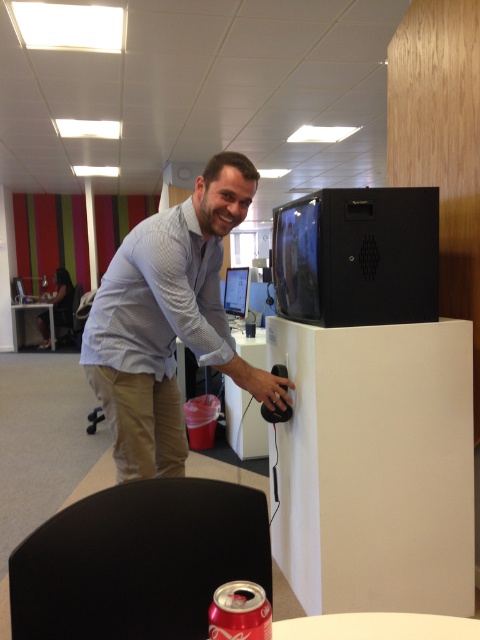
You are a delivery robot with a 1.2 meter long package. You need to navigate from the entrance to the desk in this office. There is a black plastic monitor at upper right and a red matte soda can at lower center. Can you fit the package between these two objects without tilting it?

The distance between the black plastic monitor at upper right and the red matte soda can at lower center is 1.37 meters. Since the package is 1.2 meters long, it can fit between them as the space is wider than the package.

You are an office assistant who needs to hang a picture frame that is 1 meter tall on the wall behind the light blue shirt at center and matte black monitor at center. Considering their heights, which object will have its top closer to the frame once it is hung?

The light blue shirt at center has a greater height compared to the matte black monitor at center. Therefore, the top of the light blue shirt at center will be closer to the picture frame once it is hung on the wall.